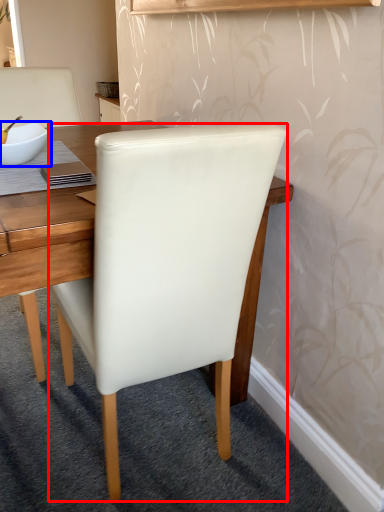
Question: Which object is further to the camera taking this photo, chair (highlighted by a red box) or bowl (highlighted by a blue box)?

Choices:
 (A) chair
 (B) bowl

Answer: (B)